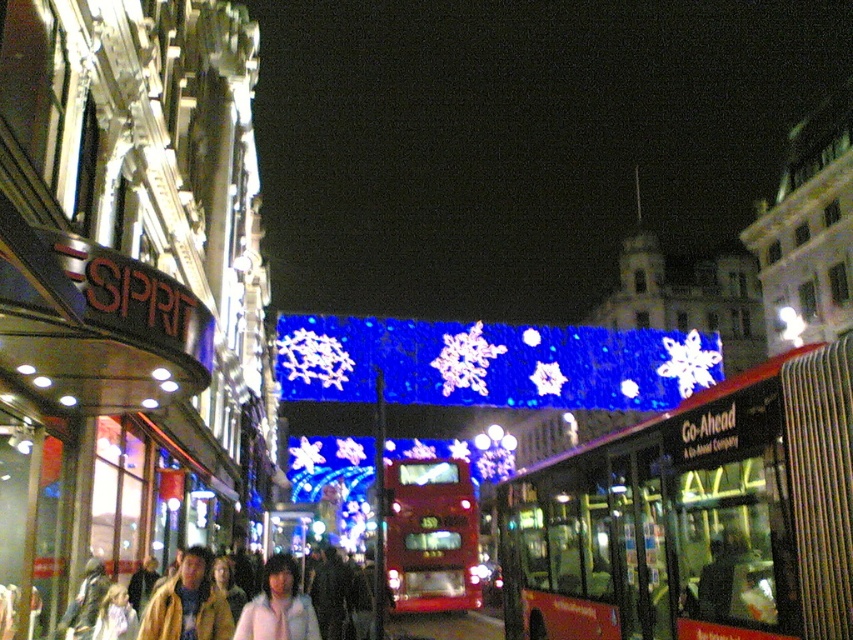
Question: Is red metallic bus at center to the right of leather jacket at lower left from the viewer's perspective?

Choices:
 (A) yes
 (B) no

Answer: (A)

Question: Which object is closer to the camera taking this photo?

Choices:
 (A) shiny red bus at center
 (B) white matte jacket at lower center

Answer: (B)

Question: Which object appears closest to the camera in this image?

Choices:
 (A) leather jacket at lower left
 (B) white matte jacket at lower center
 (C) shiny red bus at center

Answer: (A)

Question: Does leather jacket at lower left lie behind white matte jacket at lower center?

Choices:
 (A) no
 (B) yes

Answer: (A)

Question: Does shiny red bus at center have a greater width compared to leather jacket at lower left?

Choices:
 (A) yes
 (B) no

Answer: (A)

Question: Which object appears closest to the camera in this image?

Choices:
 (A) red metallic bus at center
 (B) leather jacket at lower left
 (C) white matte jacket at lower center

Answer: (A)